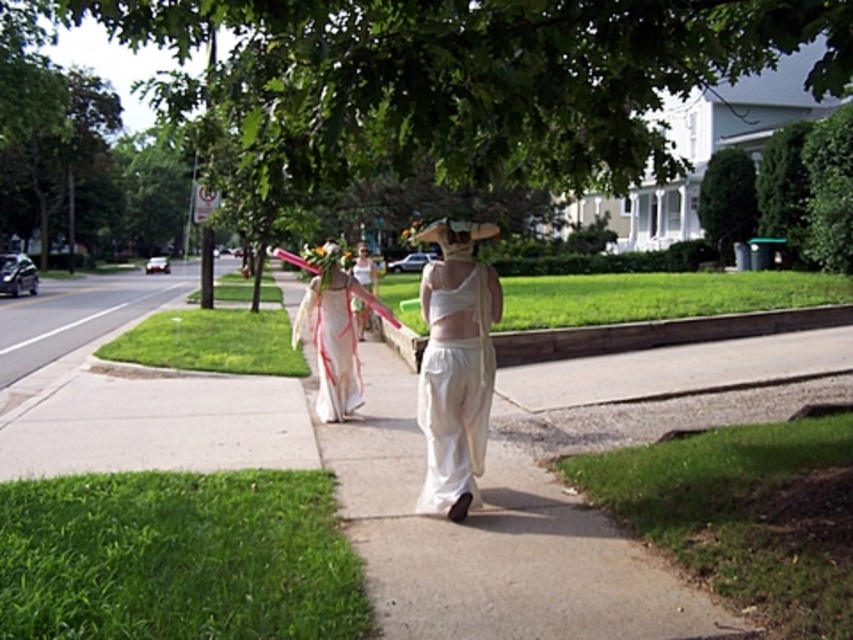
Question: Which point is closer to the camera?

Choices:
 (A) white satin dress at center
 (B) green leafy tree at center
 (C) white sheer fabric dress at center

Answer: (B)

Question: Is white satin dress at center wider than white cotton dress at center?

Choices:
 (A) no
 (B) yes

Answer: (A)

Question: Which point appears farthest from the camera in this image?

Choices:
 (A) (332, 177)
 (B) (474, 364)
 (C) (373, 284)
 (D) (317, 365)

Answer: (C)

Question: Can you confirm if white sheer fabric dress at center is wider than white cotton dress at center?

Choices:
 (A) yes
 (B) no

Answer: (B)

Question: Among these points, which one is nearest to the camera?

Choices:
 (A) (341, 305)
 (B) (368, 285)
 (C) (456, 452)

Answer: (C)

Question: Is green leafy tree at center smaller than white sheer fabric dress at center?

Choices:
 (A) yes
 (B) no

Answer: (B)